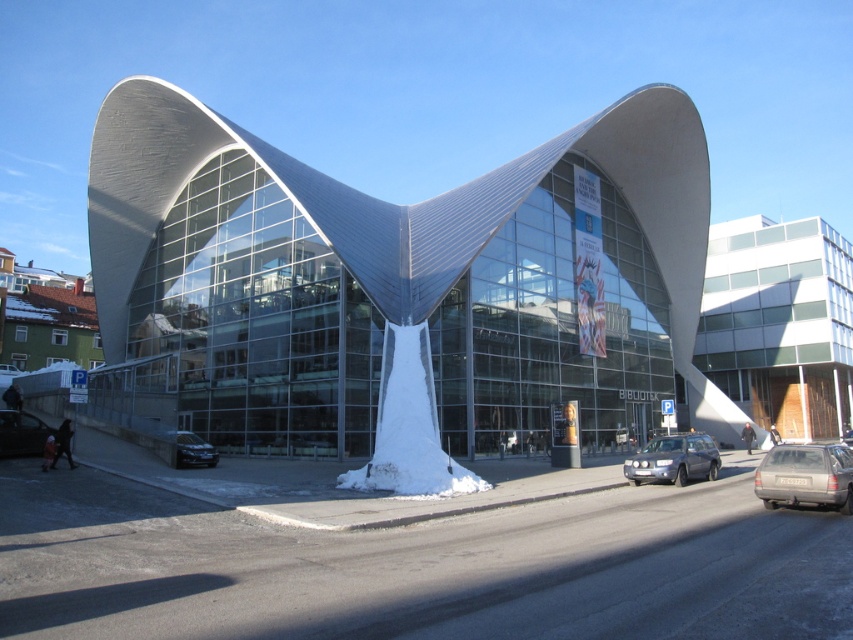
Which of these two, white wooden door at right or metallic silver suv at center, stands taller?

white wooden door at right is taller.

Does white wooden door at right appear under metallic silver suv at center?

Incorrect, white wooden door at right is not positioned below metallic silver suv at center.

This screenshot has width=853, height=640. What are the coordinates of `white wooden door at right` in the screenshot? It's located at (779, 323).

Is black matte car at lower left smaller than satin black sedan at lower left?

Indeed, black matte car at lower left has a smaller size compared to satin black sedan at lower left.

Is point (22, 416) more distant than point (181, 461)?

No, (22, 416) is in front of (181, 461).

Between point (16, 445) and point (200, 451), which one is positioned behind?

The point (200, 451) is behind.

This screenshot has width=853, height=640. Find the location of `black matte car at lower left`. black matte car at lower left is located at coordinates (21, 433).

Does silver metallic car at lower right have a smaller size compared to black matte car at lower left?

Incorrect, silver metallic car at lower right is not smaller in size than black matte car at lower left.

Does point (851, 477) come in front of point (10, 424)?

Yes, it is in front of point (10, 424).

Where is `silver metallic car at lower right`? The image size is (853, 640). silver metallic car at lower right is located at coordinates [x=805, y=476].